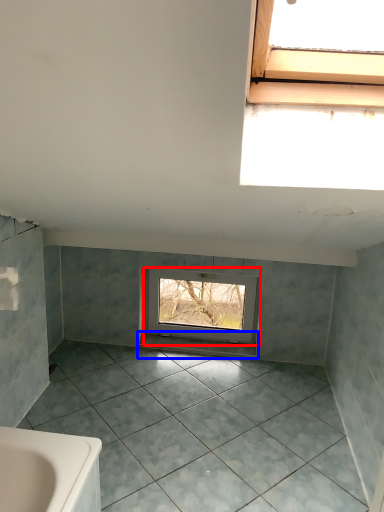
Question: Which of the following is the closest to the observer, window (highlighted by a red box) or window sill (highlighted by a blue box)?

Choices:
 (A) window
 (B) window sill

Answer: (A)